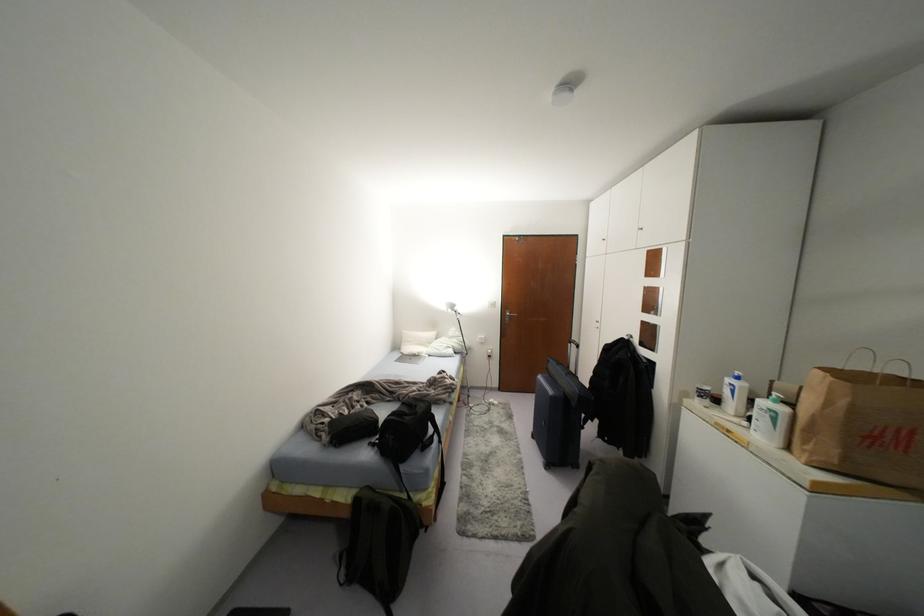
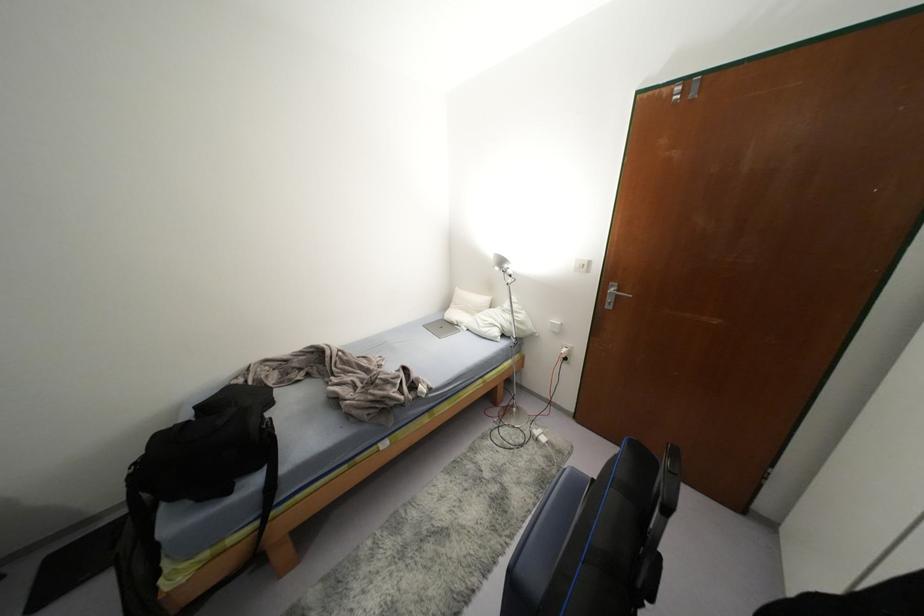
Where in the second image is the point corresponding to (x=415, y=357) from the first image?

(452, 325)